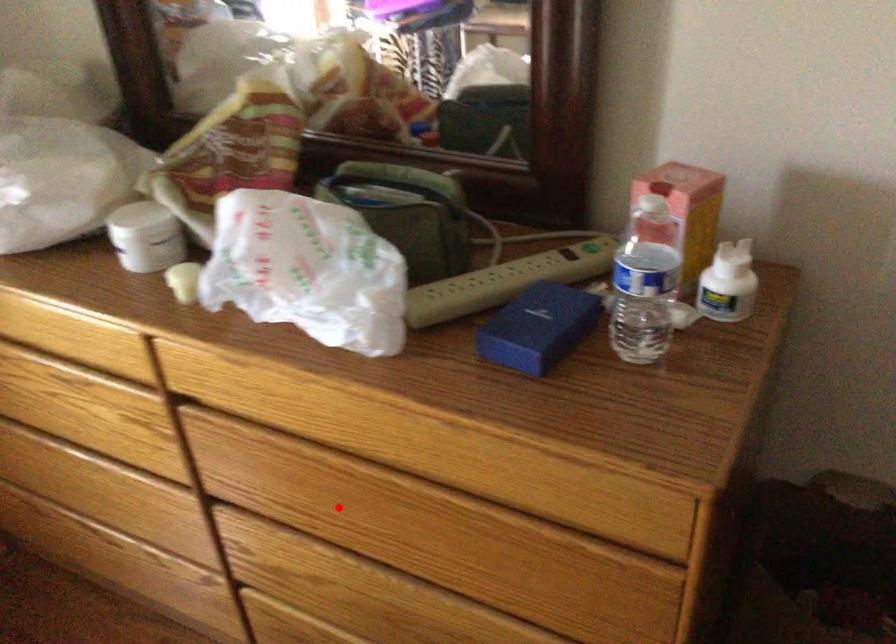
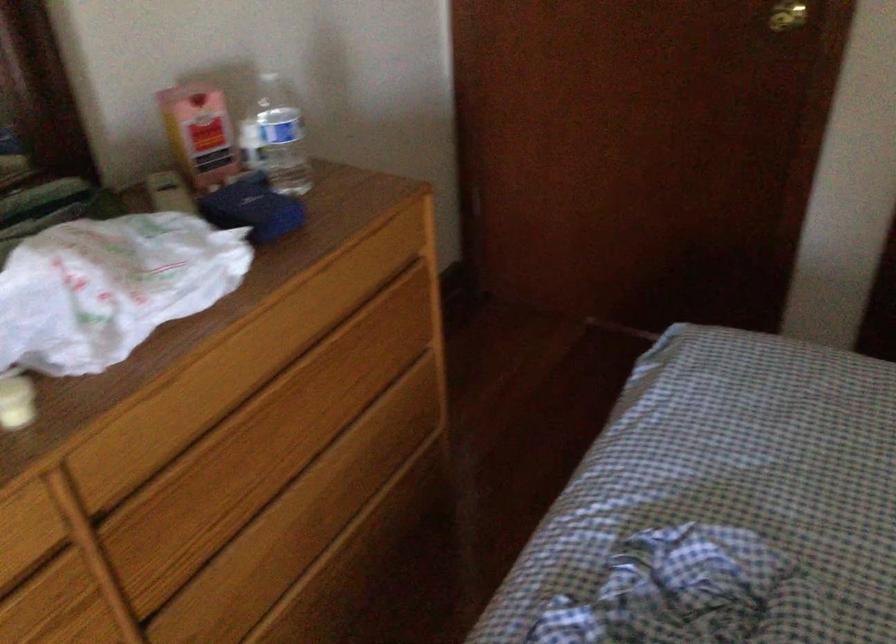
The point at the highlighted location is marked in the first image. Where is the corresponding point in the second image?

(263, 456)